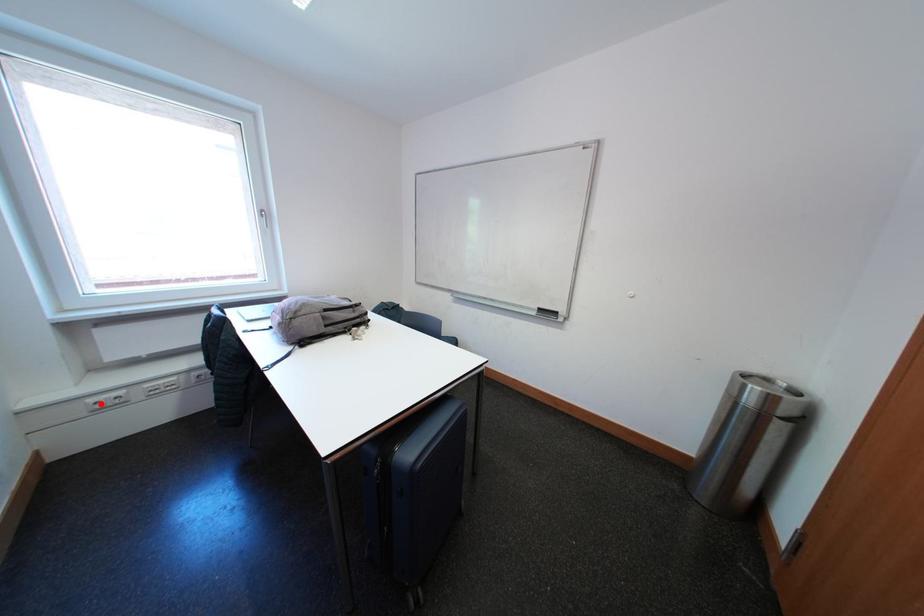
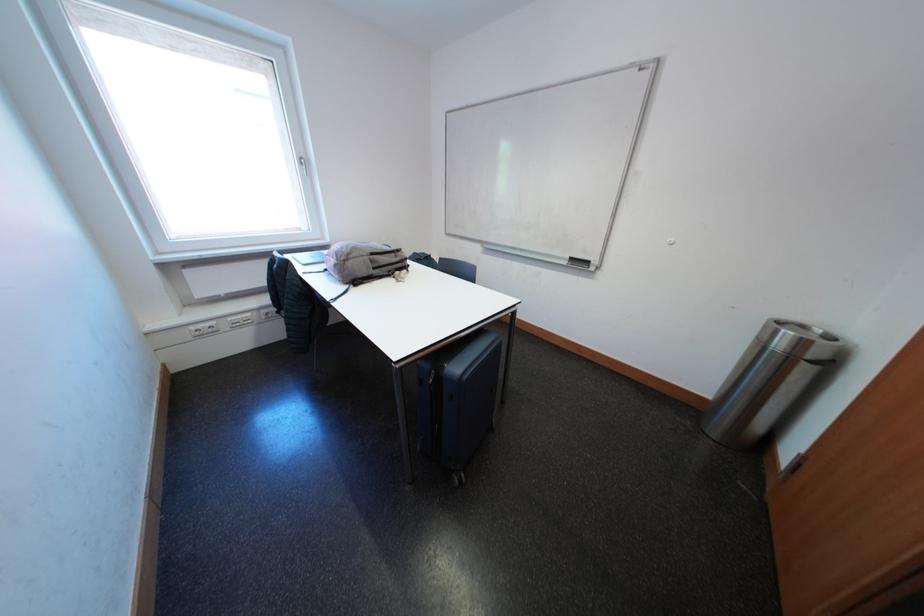
Locate, in the second image, the point that corresponds to the highlighted location in the first image.

(202, 331)